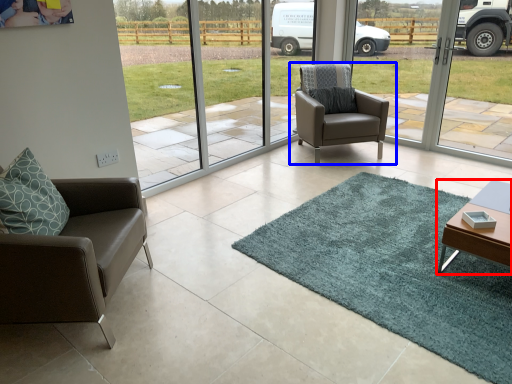
Question: Which of the following is the closest to the observer, table (highlighted by a red box) or chair (highlighted by a blue box)?

Choices:
 (A) table
 (B) chair

Answer: (A)